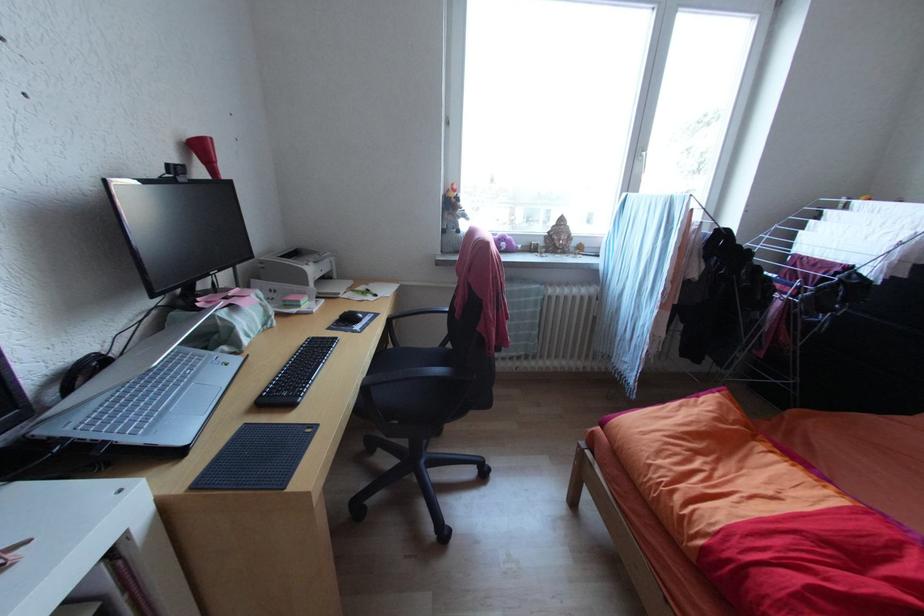
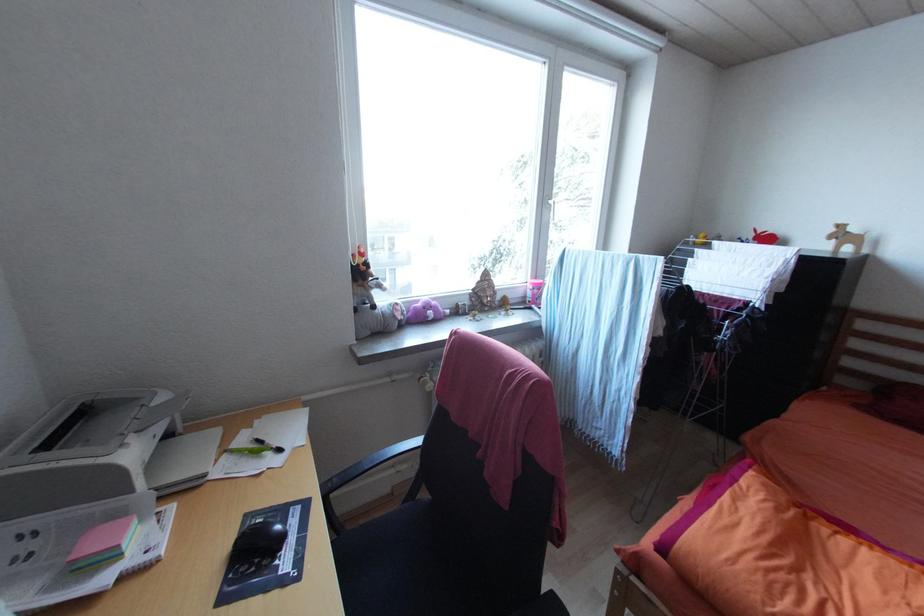
What movement of the cameraman would produce the second image?

The cameraman moved toward left, forward.